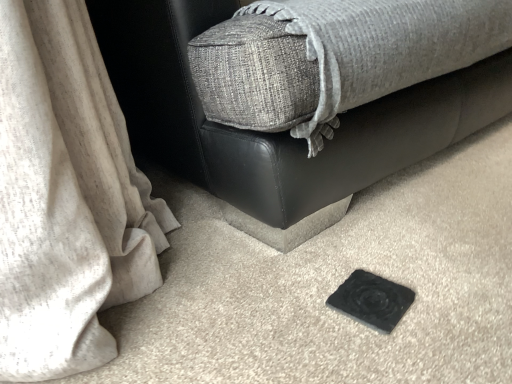
Question: Is black rubber pad at lower center oriented towards black matte coaster at lower center?

Choices:
 (A) yes
 (B) no

Answer: (A)

Question: Would you consider black rubber pad at lower center to be distant from black matte coaster at lower center?

Choices:
 (A) no
 (B) yes

Answer: (A)

Question: Does black rubber pad at lower center appear on the right side of black matte coaster at lower center?

Choices:
 (A) yes
 (B) no

Answer: (B)

Question: Considering the relative sizes of black rubber pad at lower center and black matte coaster at lower center in the image provided, is black rubber pad at lower center taller than black matte coaster at lower center?

Choices:
 (A) yes
 (B) no

Answer: (B)

Question: From the image's perspective, is black rubber pad at lower center on black matte coaster at lower center?

Choices:
 (A) no
 (B) yes

Answer: (A)

Question: From a real-world perspective, is black rubber pad at lower center beneath black matte coaster at lower center?

Choices:
 (A) yes
 (B) no

Answer: (A)

Question: Can you confirm if black matte coaster at lower center is smaller than black rubber pad at lower center?

Choices:
 (A) no
 (B) yes

Answer: (A)

Question: Does black matte coaster at lower center lie behind black rubber pad at lower center?

Choices:
 (A) no
 (B) yes

Answer: (A)

Question: Is black matte coaster at lower center turned away from black rubber pad at lower center?

Choices:
 (A) no
 (B) yes

Answer: (A)

Question: Is black matte coaster at lower center positioned far away from black rubber pad at lower center?

Choices:
 (A) no
 (B) yes

Answer: (A)

Question: Could you tell me if black matte coaster at lower center is turned towards black rubber pad at lower center?

Choices:
 (A) yes
 (B) no

Answer: (A)

Question: Is black matte coaster at lower center shorter than black rubber pad at lower center?

Choices:
 (A) yes
 (B) no

Answer: (B)

Question: Is black rubber pad at lower center wider or thinner than black matte coaster at lower center?

Choices:
 (A) thin
 (B) wide

Answer: (A)